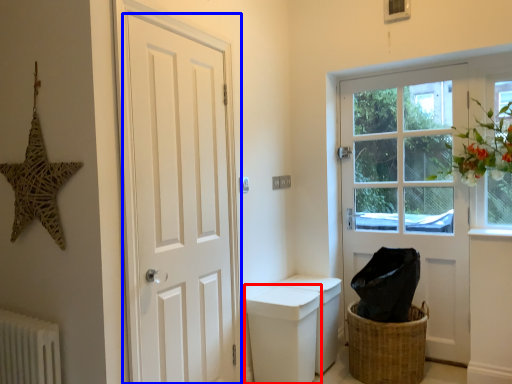
Question: Which of the following is the farthest to the observer, toilet bowl (highlighted by a red box) or door (highlighted by a blue box)?

Choices:
 (A) toilet bowl
 (B) door

Answer: (A)